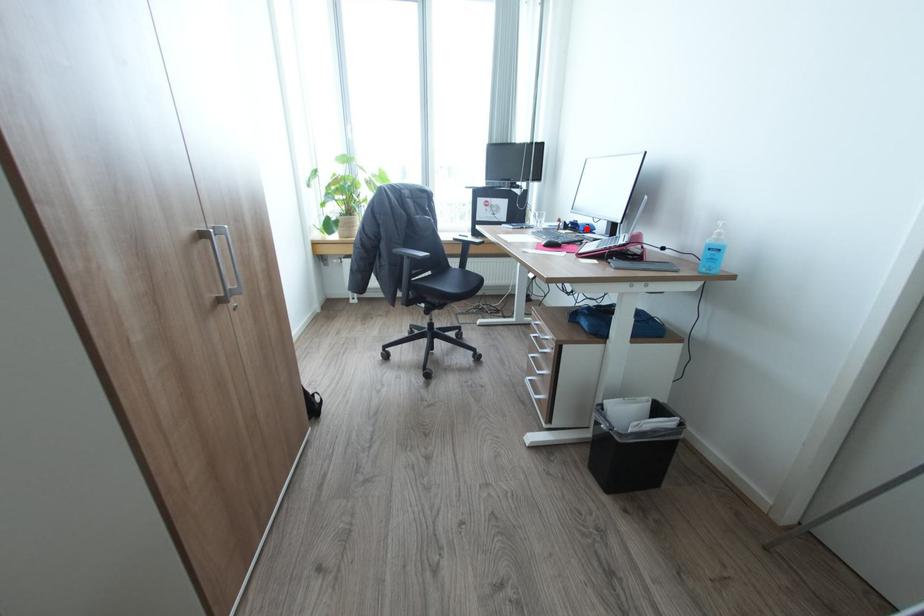
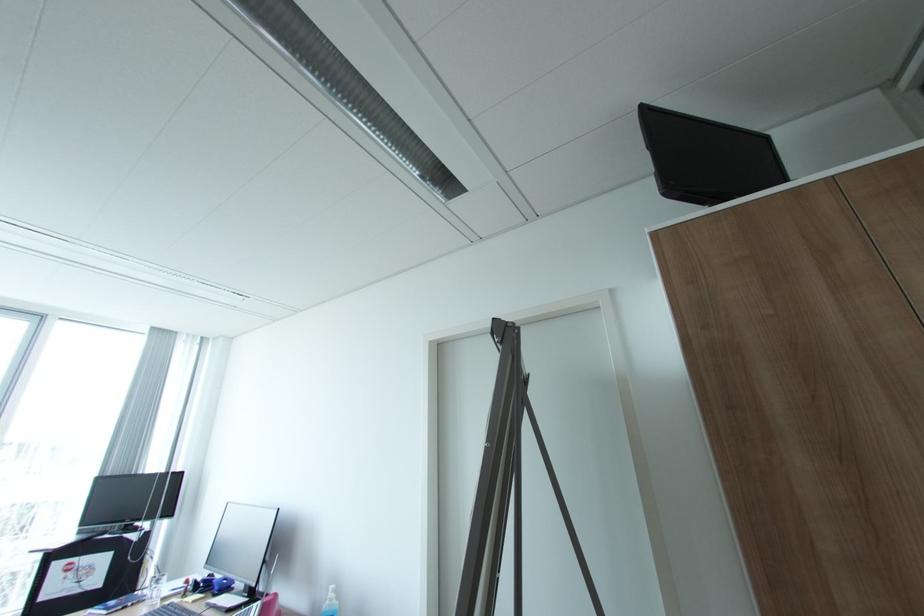
The point at the highlighted location is marked in the first image. Where is the corresponding point in the second image?

(222, 588)